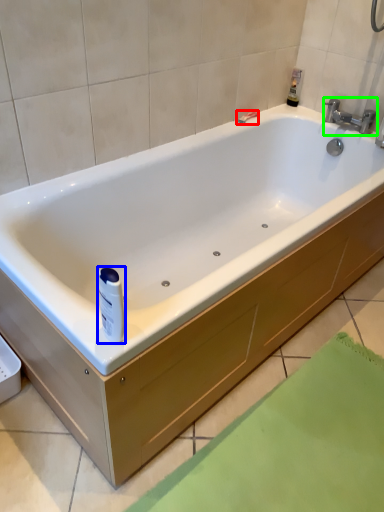
Question: Considering the real-world distances, which object is farthest from shower (highlighted by a red box)? toiletry (highlighted by a blue box) or tap (highlighted by a green box)?

Choices:
 (A) toiletry
 (B) tap

Answer: (A)